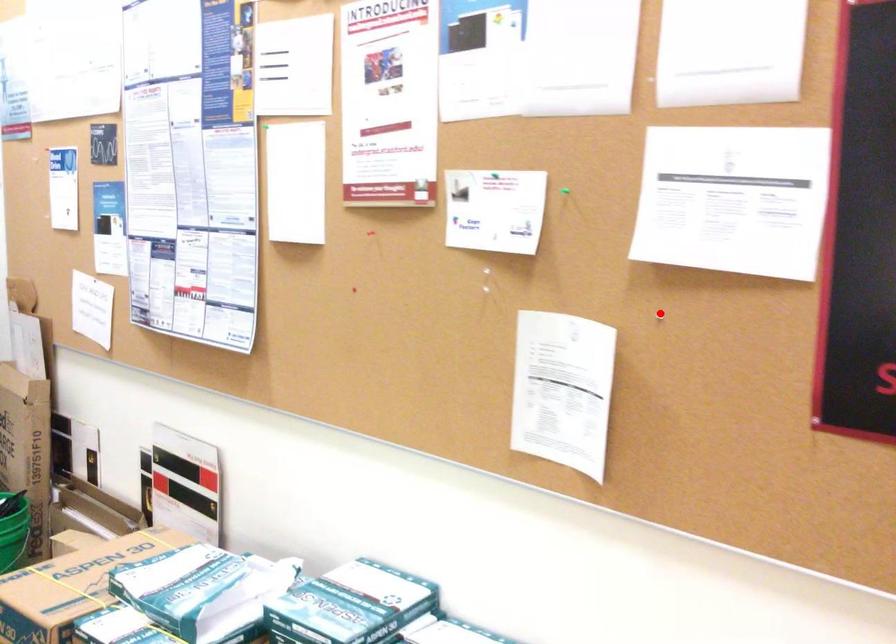
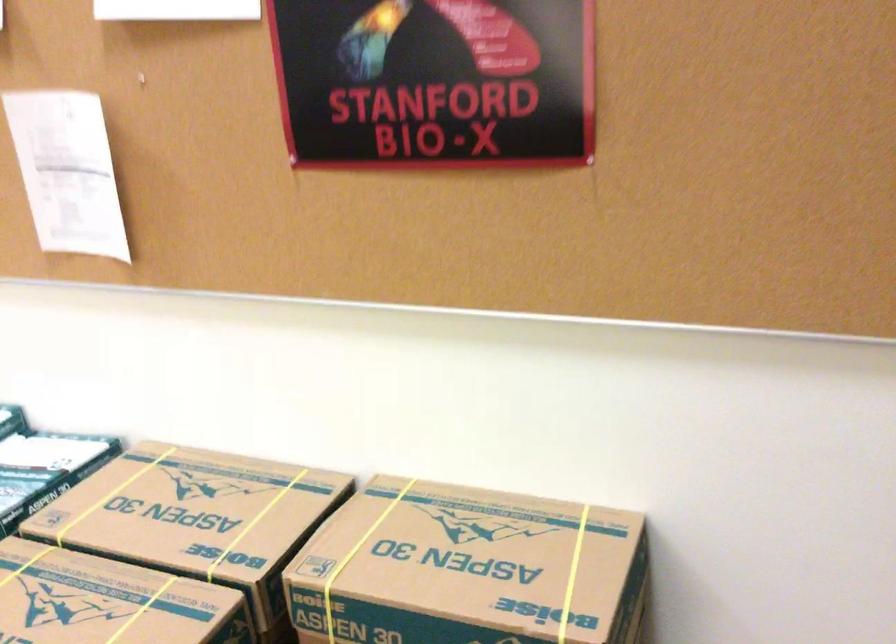
Where in the second image is the point corresponding to the highlighted location from the first image?

(141, 79)